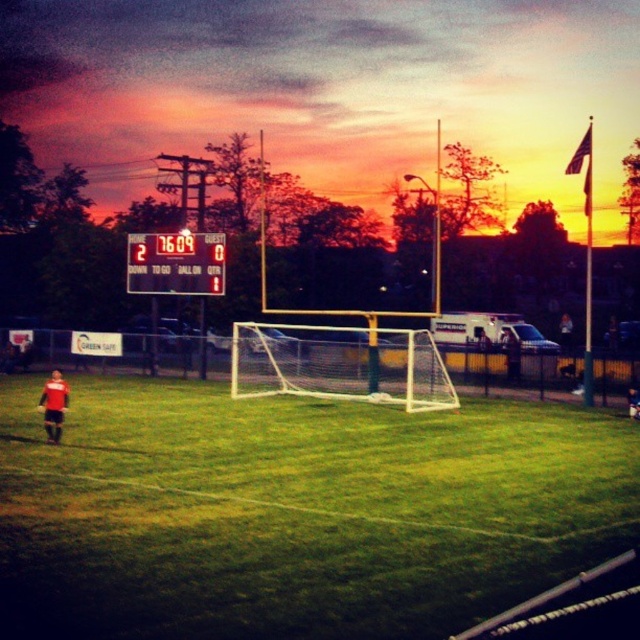
Is black plastic scoreboard at center behind matte black soccer player at center?

Yes, black plastic scoreboard at center is further from the viewer.

Looking at this image, between black plastic scoreboard at center and matte black soccer player at center, which one has less height?

matte black soccer player at center is shorter.

You are a GUI agent. You are given a task and a screenshot of the screen. Output one action in this format:
    pyautogui.click(x=<x>, y=<y>)
    Task: Click on the black plastic scoreboard at center
    The height and width of the screenshot is (640, 640).
    Given the screenshot: What is the action you would take?
    pyautogui.click(x=176, y=262)

Who is lower down, green grass soccer field at center or matte black soccer player at center?

green grass soccer field at center

Which of these two, green grass soccer field at center or matte black soccer player at center, stands taller?

Standing taller between the two is matte black soccer player at center.

Describe the element at coordinates (296, 513) in the screenshot. The width and height of the screenshot is (640, 640). I see `green grass soccer field at center` at that location.

Locate an element on the screen. This screenshot has height=640, width=640. green grass soccer field at center is located at coordinates (296, 513).

Between point (385, 577) and point (54, 378), which one is positioned in front?

Point (385, 577) is in front.

I want to click on green grass soccer field at center, so click(x=296, y=513).